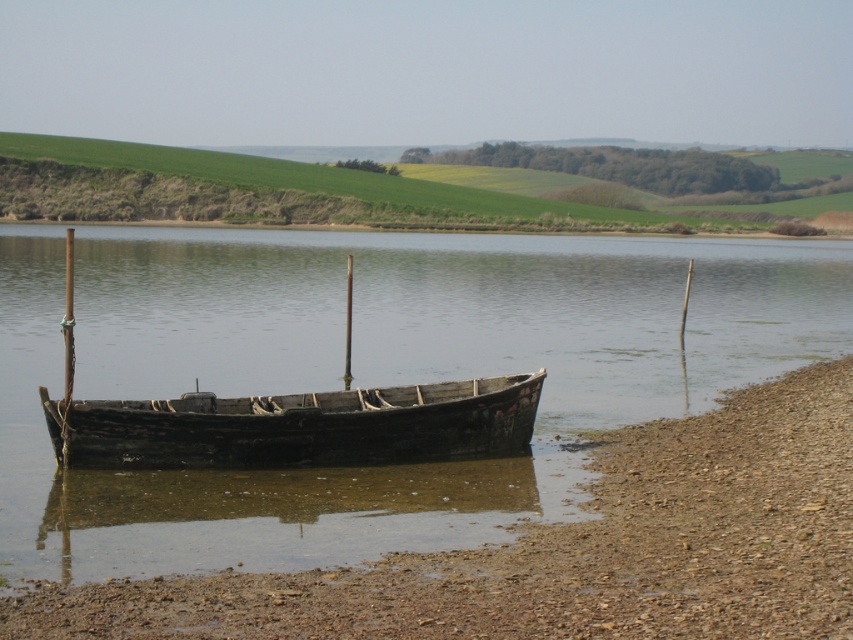
You are standing on the pebbled shore and want to reach the brown wooden boat at center. According to the coordinates provided, which direction should you walk to reach it?

The brown wooden boat at center is located at coordinates point (369, 372), so you should walk towards the center of the image to reach it.

You are standing on the pebbled shore and want to board the boat. Which boat, the brown wooden boat at center or the rusty wood boat at center, is closer to the shore?

The brown wooden boat at center is closer to the shore because it is in front of the rusty wood boat at center.

You are planning to take a short trip on the water. You have to choose between the rusty wood boat at center and the dark brown wooden canoe at center. Which one would you choose and why?

The rusty wood boat at center is larger in size than the dark brown wooden canoe at center, so you should choose the rusty wood boat at center for better stability and space during your trip.